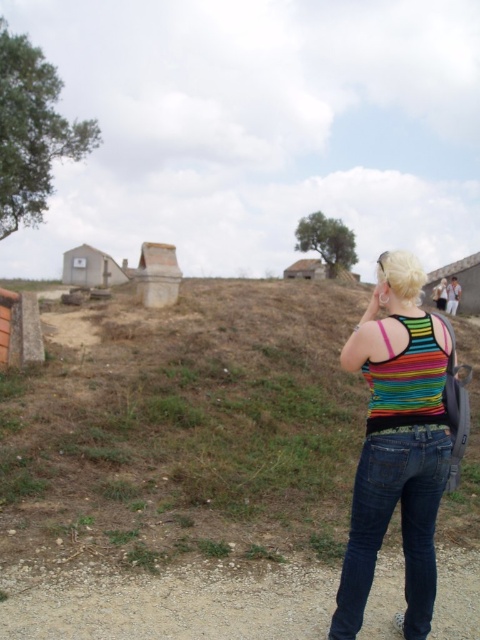
You are a hiker trying to reach the top of the brown grassy hillside at center. There is a white corrugated metal hut at lower left nearby. Which object is taller, making it an obstacle in your path?

The white corrugated metal hut at lower left is taller than the brown grassy hillside at center, so it would be the obstacle in your path.

You are a photographer trying to capture the entire brown grassy hillside at center and the rainbow striped tank top at right in one frame. Based on their widths, will the hillside fit entirely in the photo?

The brown grassy hillside at center might be wider than the rainbow striped tank top at right, so it may not fit entirely in the photo depending on the camera angle and zoom.